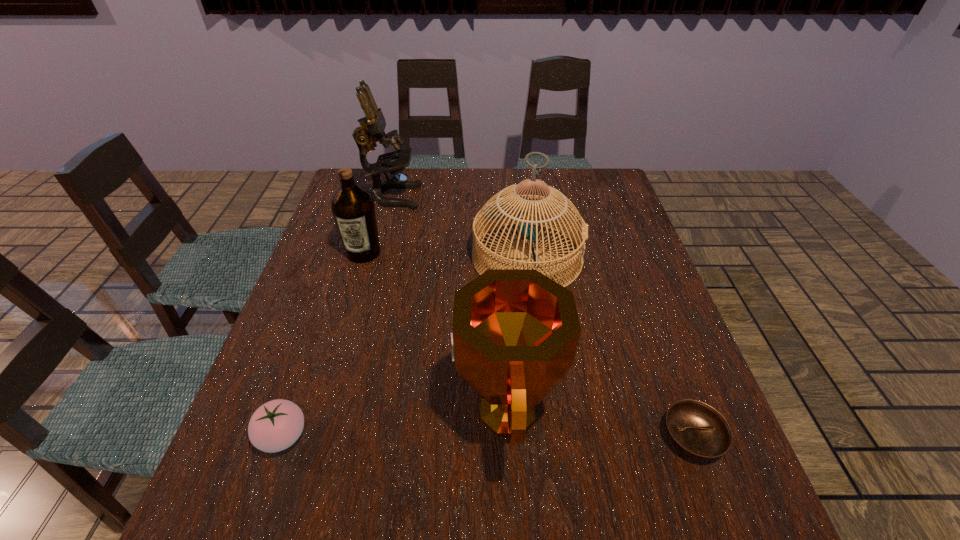
What are the coordinates of `vacant space located on the side of the award with the star emblem` in the screenshot? It's located at (335, 411).

Find the location of a particular element. This screenshot has height=540, width=960. blank area located 0.090m on the side of the award with the star emblem is located at coordinates (410, 411).

Find the location of a particular element. vacant space located on the side of the award with the star emblem is located at coordinates (324, 411).

Image resolution: width=960 pixels, height=540 pixels. I want to click on vacant area situated on the label of the olive oil, so click(x=330, y=362).

Where is `vacant space located 0.380m on the back of the tomato`? The image size is (960, 540). vacant space located 0.380m on the back of the tomato is located at coordinates (336, 281).

Locate an element on the screen. This screenshot has width=960, height=540. free space located 0.070m on the front of the rightmost object is located at coordinates (718, 509).

Image resolution: width=960 pixels, height=540 pixels. Identify the location of object located in the far edge section of the desktop. (372, 128).

Find the location of a particular element. This screenshot has width=960, height=540. microscope situated at the left edge is located at coordinates (372, 128).

Identify the location of olive oil at the left edge. Image resolution: width=960 pixels, height=540 pixels. (353, 208).

Find the location of a particular element. tomato at the left edge is located at coordinates (276, 425).